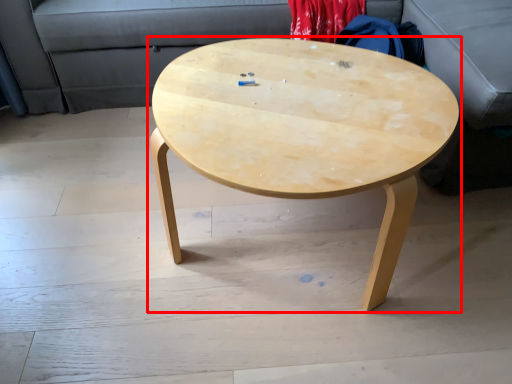
Question: From the image's perspective, where is coffee table (annotated by the red box) located in relation to couch in the image?

Choices:
 (A) above
 (B) below

Answer: (B)